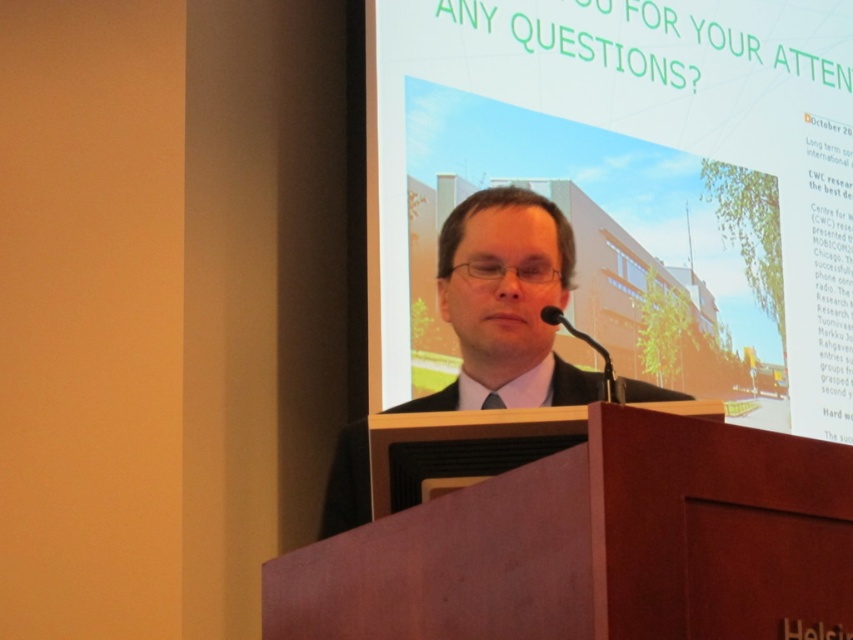
Question: Can you confirm if brown wood podium at center is positioned to the left of black satin tie at center?

Choices:
 (A) no
 (B) yes

Answer: (B)

Question: Which point is farther from the camera taking this photo?

Choices:
 (A) (485, 401)
 (B) (483, 256)

Answer: (B)

Question: In this image, where is black suit at center located relative to black satin tie at center?

Choices:
 (A) below
 (B) above

Answer: (B)

Question: Does brown wood podium at center come in front of black satin tie at center?

Choices:
 (A) yes
 (B) no

Answer: (A)

Question: Among these points, which one is farthest from the camera?

Choices:
 (A) (492, 404)
 (B) (723, 488)

Answer: (A)

Question: Which point is farther from the camera taking this photo?

Choices:
 (A) (293, 589)
 (B) (490, 264)

Answer: (B)